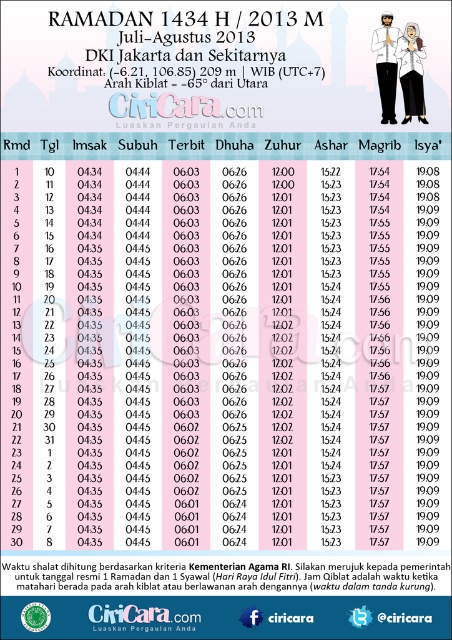
Which is below, white cotton shirt at upper right or matte white shirt at center?

white cotton shirt at upper right is lower down.

Which is in front, point (410, 81) or point (392, 113)?

Point (410, 81) is more forward.

In order to click on white cotton shirt at upper right in this screenshot , I will do `click(412, 72)`.